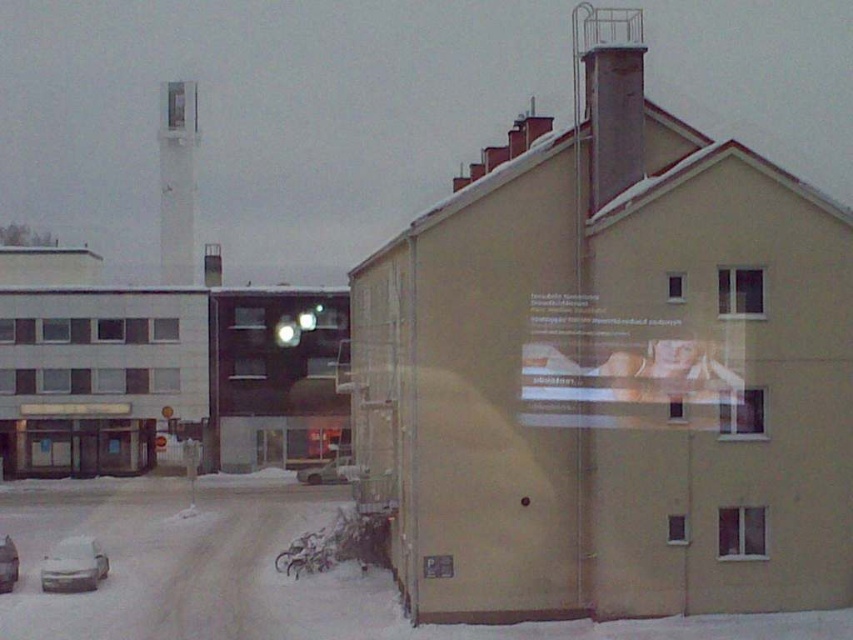
Does white matte car at lower left appear on the right side of silver metallic car at lower left?

Correct, you'll find white matte car at lower left to the right of silver metallic car at lower left.

Which of these two, white matte car at lower left or silver metallic car at lower left, stands taller?

With more height is silver metallic car at lower left.

Locate an element on the screen. white matte car at lower left is located at coordinates (73, 564).

Where is `white matte car at lower left`? This screenshot has width=853, height=640. white matte car at lower left is located at coordinates (73, 564).

Who is higher up, white glossy chimney at upper left or silver metallic car at lower left?

Positioned higher is white glossy chimney at upper left.

Between point (186, 156) and point (7, 586), which one is positioned behind?

Point (186, 156)

At what (x,y) coordinates should I click in order to perform the action: click on white glossy chimney at upper left. Please return your answer as a coordinate pair (x, y). Looking at the image, I should click on (177, 182).

Can you confirm if white glossy chimney at upper left is wider than white matte car at lower left?

Yes.

Between white glossy chimney at upper left and white matte car at lower left, which one appears on the left side from the viewer's perspective?

From the viewer's perspective, white glossy chimney at upper left appears more on the left side.

Between point (178, 163) and point (102, 548), which one is positioned behind?

The point (178, 163) is behind.

Locate an element on the screen. white glossy chimney at upper left is located at coordinates (177, 182).